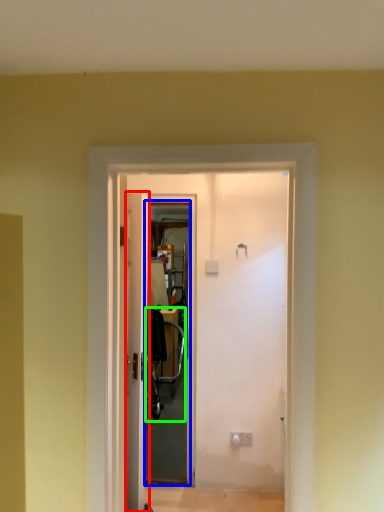
Question: Which object is the farthest from door (highlighted by a red box)? Choose among these: screen door (highlighted by a blue box) or chair (highlighted by a green box).

Choices:
 (A) screen door
 (B) chair

Answer: (B)